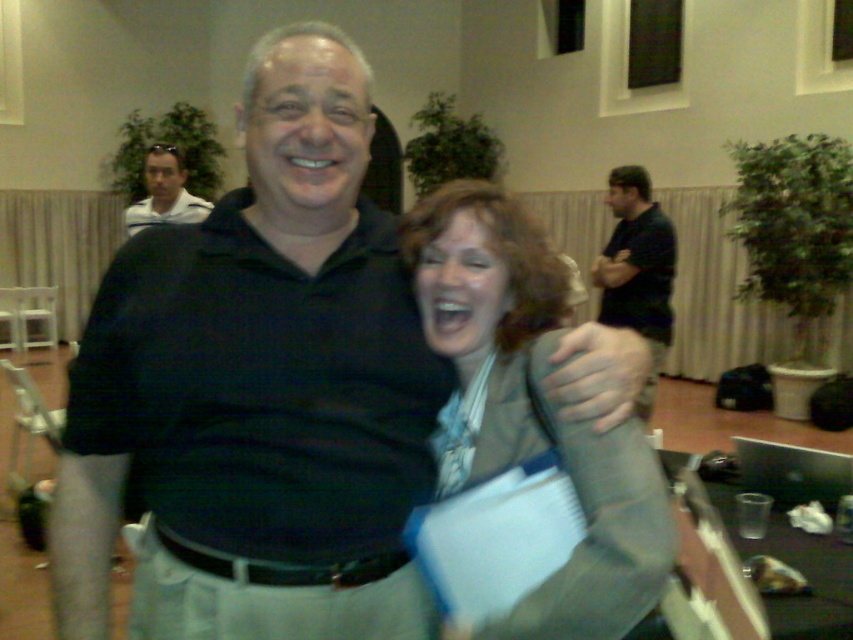
You are a photographer standing in front of the matte gray blazer at center and want to take a clear photo of it. If your camera requires a minimum distance of 30 inches to focus properly, can you take the photo without moving closer?

The matte gray blazer at center and viewer are 31.10 inches apart from each other. Since 31.10 inches is greater than the required 30 inches, you can take the photo without moving closer.

You are an interior designer assessing the spatial arrangement of the room in the image. You notice the black shirt at center and the matte white shirt at upper left. Which of these two shirts appears taller in the image?

The black shirt at center appears taller than the matte white shirt at upper left in the image.

From the picture: You are organizing a photo album and notice two shirts in the image. The black shirt at center and the matte white shirt at upper left. Which shirt is located lower in the image?

The black shirt at center is positioned under the matte white shirt at upper left, so the black shirt at center is lower in the image.